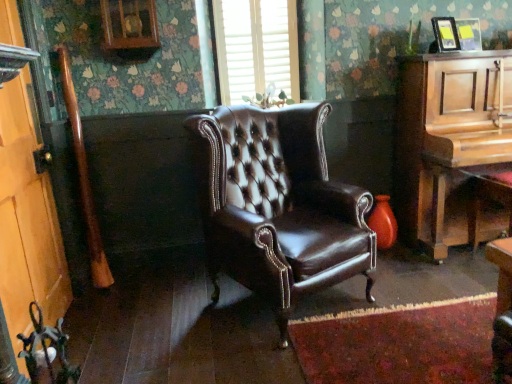
Question: From the image's perspective, is white textured blinds at upper center above wooden door at left?

Choices:
 (A) no
 (B) yes

Answer: (B)

Question: From a real-world perspective, does white textured blinds at upper center stand above wooden door at left?

Choices:
 (A) yes
 (B) no

Answer: (A)

Question: Is white textured blinds at upper center looking in the opposite direction of wooden door at left?

Choices:
 (A) yes
 (B) no

Answer: (B)

Question: Considering the relative sizes of white textured blinds at upper center and wooden door at left in the image provided, is white textured blinds at upper center wider than wooden door at left?

Choices:
 (A) no
 (B) yes

Answer: (A)

Question: Can you confirm if white textured blinds at upper center is thinner than wooden door at left?

Choices:
 (A) no
 (B) yes

Answer: (B)

Question: From a real-world perspective, is brown leather wingback chair at center positioned above or below white textured blinds at upper center?

Choices:
 (A) below
 (B) above

Answer: (A)

Question: Is brown leather wingback chair at center bigger or smaller than white textured blinds at upper center?

Choices:
 (A) small
 (B) big

Answer: (B)

Question: Considering the relative positions of brown leather wingback chair at center and white textured blinds at upper center in the image provided, is brown leather wingback chair at center to the left or to the right of white textured blinds at upper center?

Choices:
 (A) left
 (B) right

Answer: (B)

Question: Choose the correct answer: Is brown leather wingback chair at center inside white textured blinds at upper center or outside it?

Choices:
 (A) inside
 (B) outside

Answer: (B)

Question: Is brown leather wingback chair at center inside or outside of wooden door at left?

Choices:
 (A) outside
 (B) inside

Answer: (A)

Question: Considering their positions, is brown leather wingback chair at center located in front of or behind wooden door at left?

Choices:
 (A) front
 (B) behind

Answer: (B)

Question: From the image's perspective, is brown leather wingback chair at center positioned above or below wooden door at left?

Choices:
 (A) above
 (B) below

Answer: (B)

Question: Visually, is brown leather wingback chair at center positioned to the left or to the right of wooden door at left?

Choices:
 (A) left
 (B) right

Answer: (B)

Question: Is point (47, 319) closer or farther from the camera than point (503, 74)?

Choices:
 (A) farther
 (B) closer

Answer: (B)

Question: Choose the correct answer: Is wooden door at left inside wooden piano at right or outside it?

Choices:
 (A) inside
 (B) outside

Answer: (B)